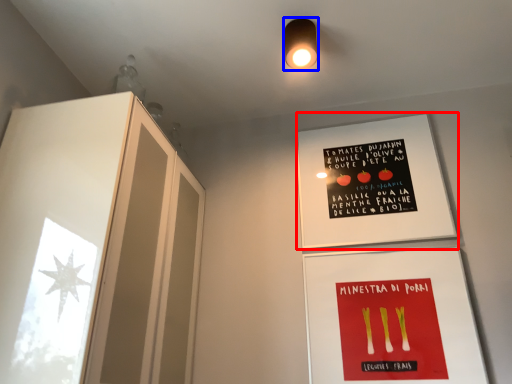
Question: Which of the following is the closest to the observer, bulletin board (highlighted by a red box) or light fixture (highlighted by a blue box)?

Choices:
 (A) bulletin board
 (B) light fixture

Answer: (B)